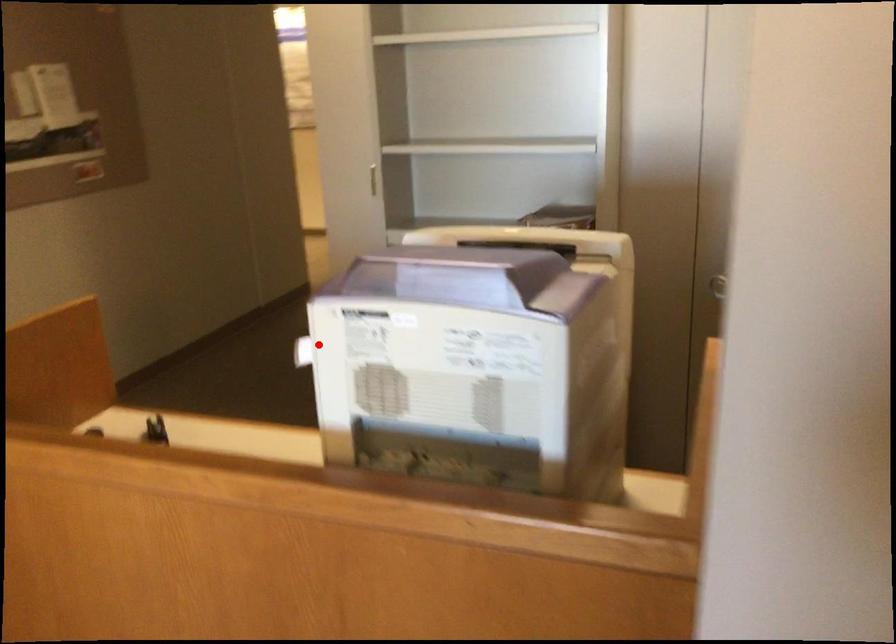
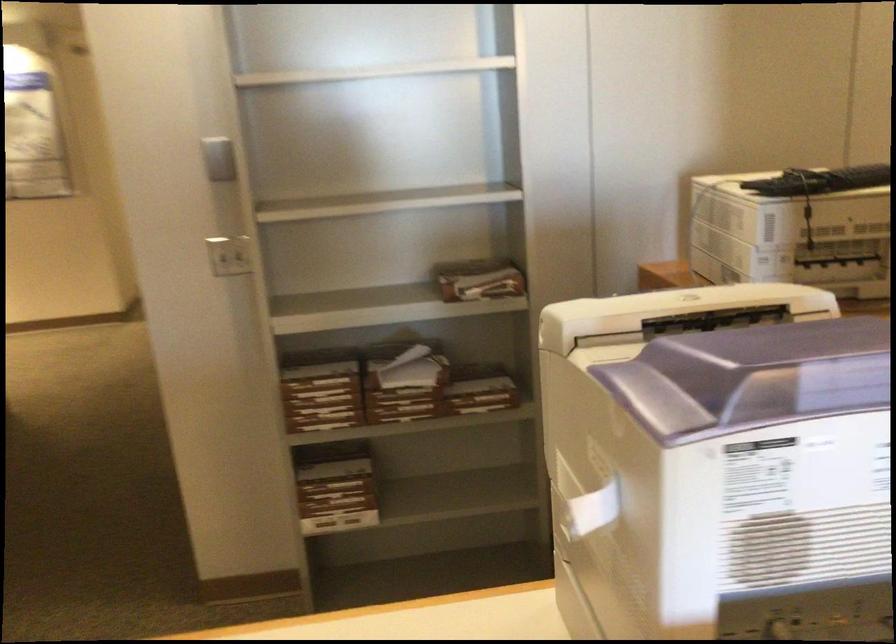
Find the pixel in the second image that matches the highlighted location in the first image.

(592, 507)